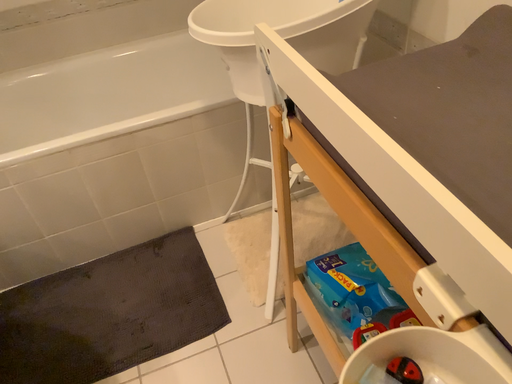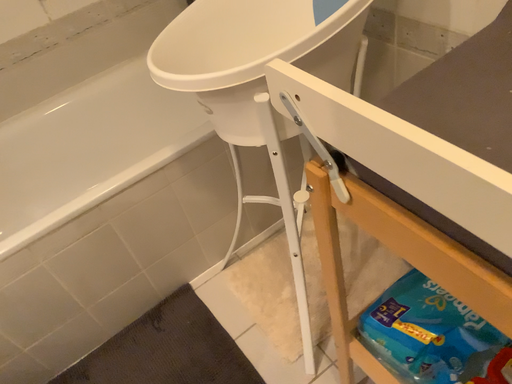
Question: How did the camera likely rotate when shooting the video?

Choices:
 (A) rotated right
 (B) rotated left

Answer: (A)